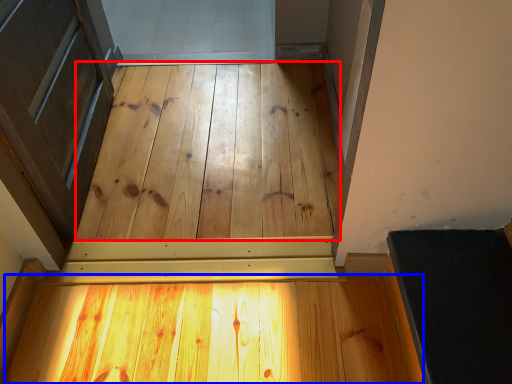
Question: Which point is closer to the camera, plywood (highlighted by a red box) or plywood (highlighted by a blue box)?

Choices:
 (A) plywood
 (B) plywood

Answer: (B)